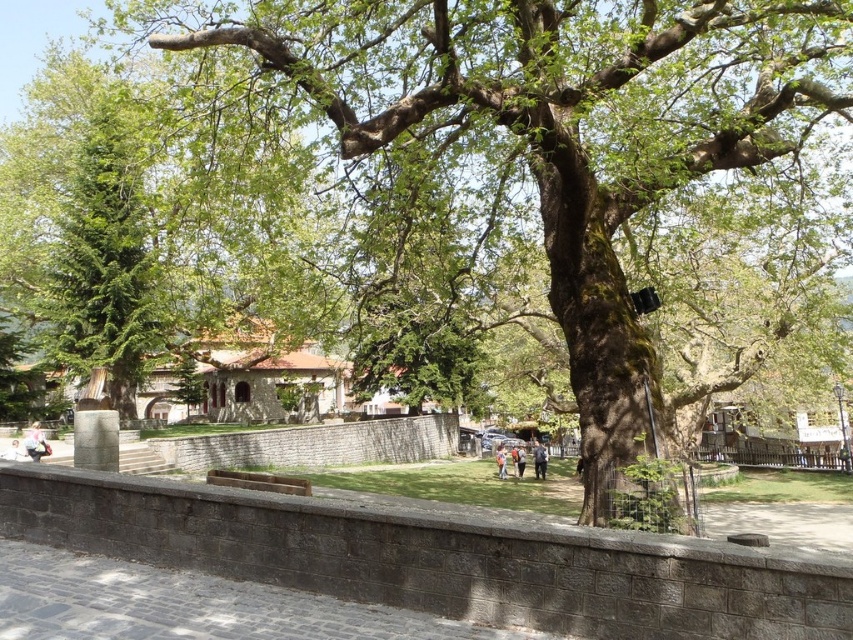
Is gray cobblestone pavement at lower left wider than orange fabric bag at center?

Yes, gray cobblestone pavement at lower left is wider than orange fabric bag at center.

Who is lower down, gray cobblestone pavement at lower left or orange fabric bag at center?

orange fabric bag at center

Between point (80, 572) and point (502, 444), which one is positioned in front?

Point (80, 572) is more forward.

You are a GUI agent. You are given a task and a screenshot of the screen. Output one action in this format:
    pyautogui.click(x=<x>, y=<y>)
    Task: Click on the gray cobblestone pavement at lower left
    
    Given the screenshot: What is the action you would take?
    pyautogui.click(x=189, y=605)

Is gray concrete pavement at lower right in front of orange fabric bag at center?

Yes, it is.

Is point (764, 513) less distant than point (498, 470)?

Yes, it is in front of point (498, 470).

At what (x,y) coordinates should I click in order to perform the action: click on gray concrete pavement at lower right. Please return your answer as a coordinate pair (x, y). Looking at the image, I should click on (782, 522).

Where is `gray cobblestone pavement at lower left`? Image resolution: width=853 pixels, height=640 pixels. gray cobblestone pavement at lower left is located at coordinates pyautogui.click(x=189, y=605).

Is gray cobblestone pavement at lower left below dark brown leather jacket at center?

No.

Is point (161, 616) behind point (537, 458)?

No, it is in front of (537, 458).

You are a GUI agent. You are given a task and a screenshot of the screen. Output one action in this format:
    pyautogui.click(x=<x>, y=<y>)
    Task: Click on the gray cobblestone pavement at lower left
    
    Given the screenshot: What is the action you would take?
    pyautogui.click(x=189, y=605)